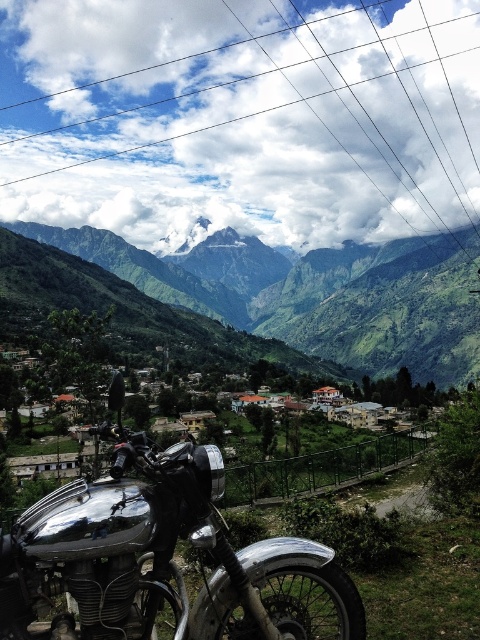
Question: Does metallic wire at upper center appear on the left side of polished chrome motorcycle at center?

Choices:
 (A) no
 (B) yes

Answer: (B)

Question: Which point is farther from the camera taking this photo?

Choices:
 (A) pos(307,260)
 (B) pos(359,0)

Answer: (B)

Question: Estimate the real-world distances between objects in this image. Which object is farther from the metallic wire at upper center?

Choices:
 (A) green grassy mountain at upper center
 (B) polished chrome motorcycle at center

Answer: (B)

Question: Can you confirm if metallic wire at upper center is wider than green grassy mountain at upper center?

Choices:
 (A) no
 (B) yes

Answer: (B)

Question: Among these objects, which one is nearest to the camera?

Choices:
 (A) polished chrome motorcycle at center
 (B) metallic wire at upper center
 (C) green grassy mountain at upper center

Answer: (A)

Question: Is the position of polished chrome motorcycle at center less distant than that of green grassy mountain at upper center?

Choices:
 (A) yes
 (B) no

Answer: (A)